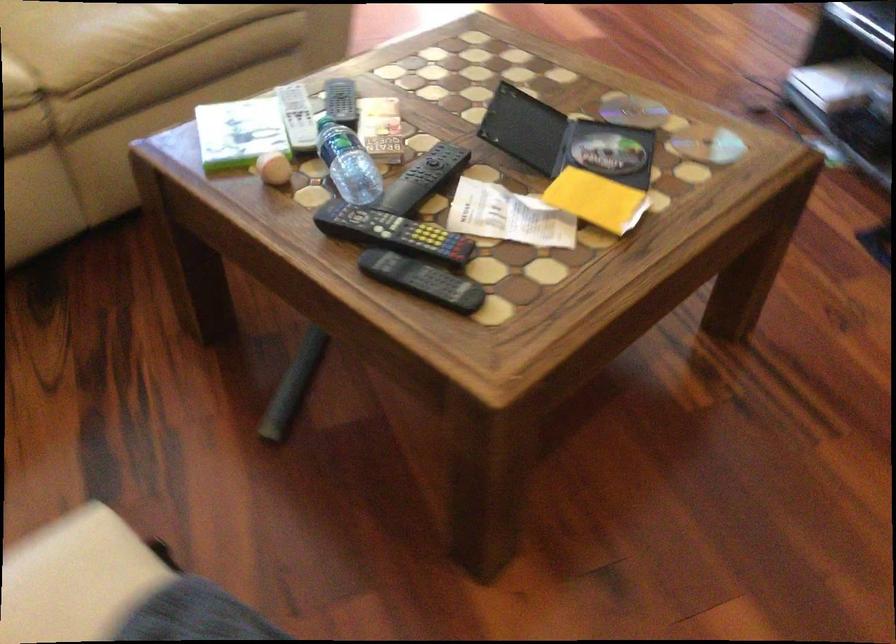
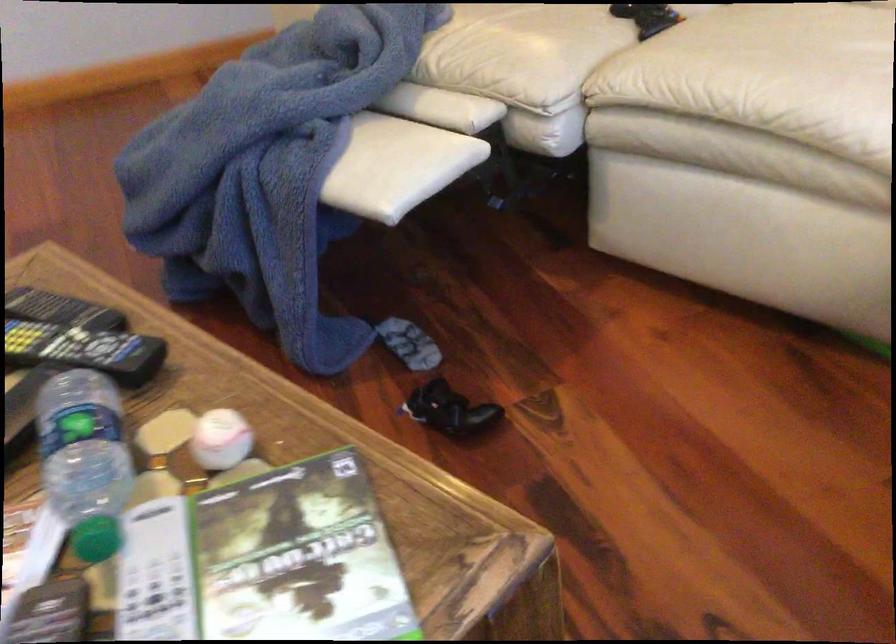
Where in the second image is the point corresponding to point (337, 113) from the first image?

(96, 538)